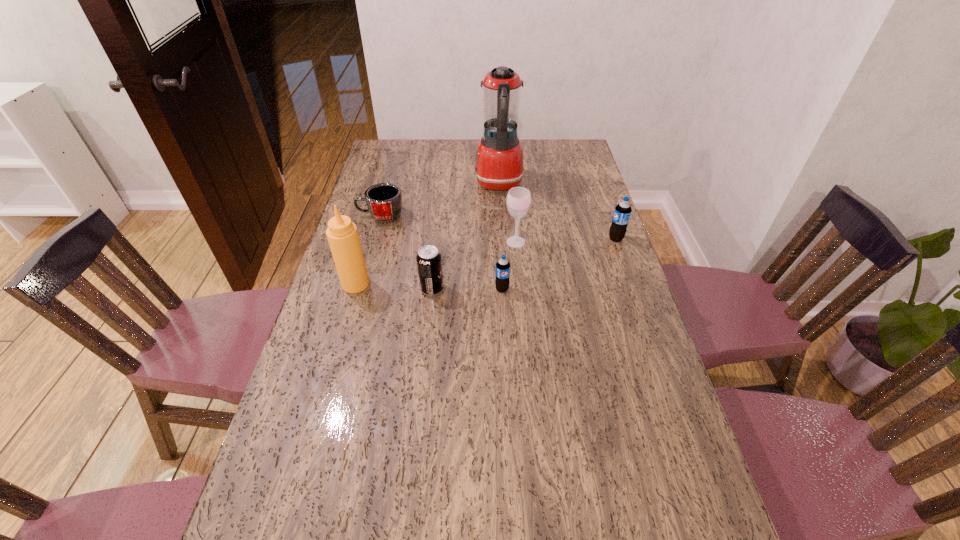
Locate an element on the screen. This screenshot has width=960, height=540. free space between the sixth nearest object and the third object from left to right is located at coordinates (406, 253).

Image resolution: width=960 pixels, height=540 pixels. I want to click on free spot between the leftmost soda can and the fifth shortest object, so click(x=474, y=266).

Where is `vacant area between the farthest soda can and the second farthest object`? Image resolution: width=960 pixels, height=540 pixels. vacant area between the farthest soda can and the second farthest object is located at coordinates (498, 227).

Where is `blank region between the farthest soda can and the fifth shortest object`? This screenshot has height=540, width=960. blank region between the farthest soda can and the fifth shortest object is located at coordinates (565, 240).

Image resolution: width=960 pixels, height=540 pixels. What are the coordinates of `empty location between the second soda can from right to left and the rightmost object` in the screenshot? It's located at (559, 264).

This screenshot has width=960, height=540. Find the location of `unoccupied area between the tallest object and the farthest soda can`. unoccupied area between the tallest object and the farthest soda can is located at coordinates (558, 211).

Identify the location of object that is the third closest to the rightmost object. Image resolution: width=960 pixels, height=540 pixels. (502, 282).

What are the coordinates of `object that is the fourth closest one to the leftmost soda can` in the screenshot? It's located at (384, 200).

I want to click on the second closest soda can to the farthest soda can, so click(x=429, y=262).

Locate an element on the screen. The image size is (960, 540). soda can that is the nearest to the second soda can from right to left is located at coordinates (429, 262).